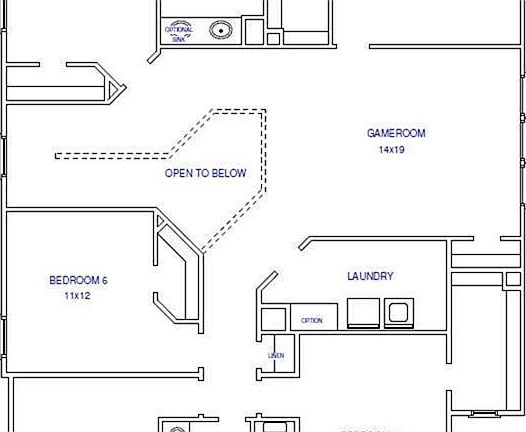
I want to click on room, so click(206, 14).